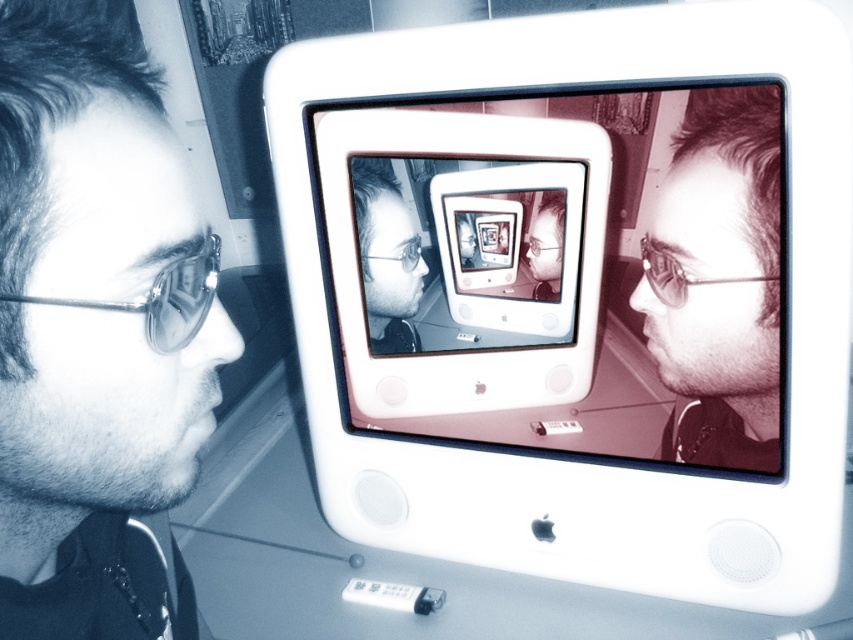
Question: Considering the real-world distances, which object is closest to the matte black face at center?

Choices:
 (A) silver metallic ipod at center
 (B) smooth metal face at left
 (C) sepia matte face at center

Answer: (C)

Question: Can you confirm if sepia matte face at center is wider than matte black face at center?

Choices:
 (A) yes
 (B) no

Answer: (A)

Question: Can you confirm if sepia matte face at center is wider than matte black face at center?

Choices:
 (A) no
 (B) yes

Answer: (B)

Question: Considering the relative positions of matte white monitor at center and matte black face at center in the image provided, where is matte white monitor at center located with respect to matte black face at center?

Choices:
 (A) above
 (B) below

Answer: (B)

Question: Which point is farther from the camera taking this photo?

Choices:
 (A) (379, 164)
 (B) (351, 582)
 (C) (186, 419)
 (D) (364, 113)

Answer: (B)

Question: Among these objects, which one is farthest from the camera?

Choices:
 (A) matte white monitor at center
 (B) matte black face at center

Answer: (B)